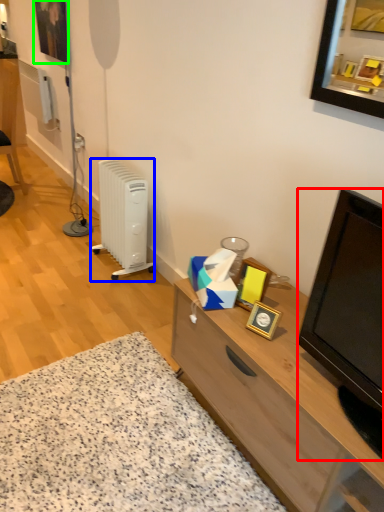
Question: Which object is the closest to the television (highlighted by a red box)? Choose among these: radiator (highlighted by a blue box) or picture frame (highlighted by a green box).

Choices:
 (A) radiator
 (B) picture frame

Answer: (A)